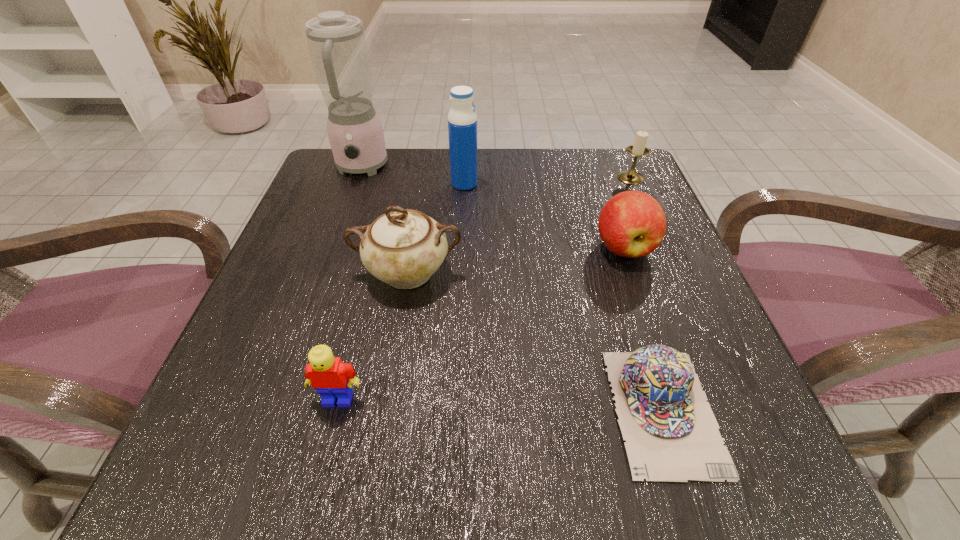
Image resolution: width=960 pixels, height=540 pixels. What are the coordinates of `the tallest object` in the screenshot? It's located at (337, 45).

Locate an element on the screen. the sixth shortest object is located at coordinates (x=462, y=119).

Where is `the fifth shortest object`? This screenshot has width=960, height=540. the fifth shortest object is located at coordinates (403, 248).

The width and height of the screenshot is (960, 540). In order to click on candle holder in this screenshot , I will do `click(638, 149)`.

Find the location of a particular element. Image resolution: width=960 pixels, height=540 pixels. apple is located at coordinates (632, 224).

Locate an element on the screen. Lego is located at coordinates (332, 379).

I want to click on the shortest object, so click(x=671, y=433).

At what (x,y) coordinates should I click in order to perform the action: click on free region located on the base of the tallest object near the control knob. Please return your answer as a coordinate pair (x, y). The width and height of the screenshot is (960, 540). Looking at the image, I should click on (330, 253).

Image resolution: width=960 pixels, height=540 pixels. What are the coordinates of `blank area located on the right of the sixth shortest object` in the screenshot? It's located at (586, 184).

This screenshot has width=960, height=540. What are the coordinates of `blank space located on the right of the chinaware` in the screenshot? It's located at (637, 273).